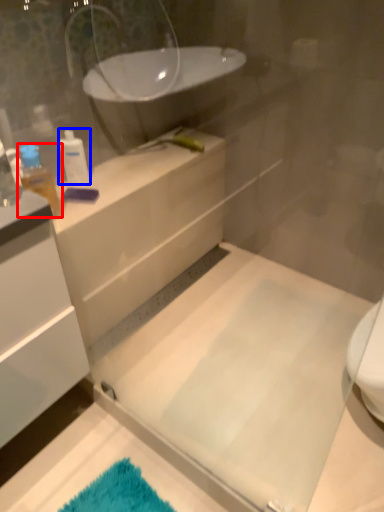
Question: Which of the following is the farthest to the observer, toiletry (highlighted by a red box) or toiletry (highlighted by a blue box)?

Choices:
 (A) toiletry
 (B) toiletry

Answer: (B)